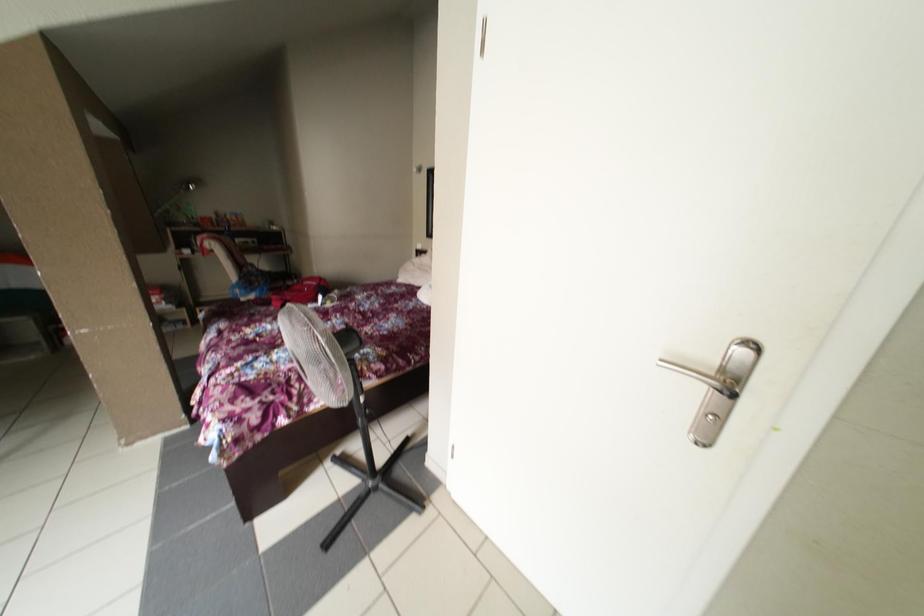
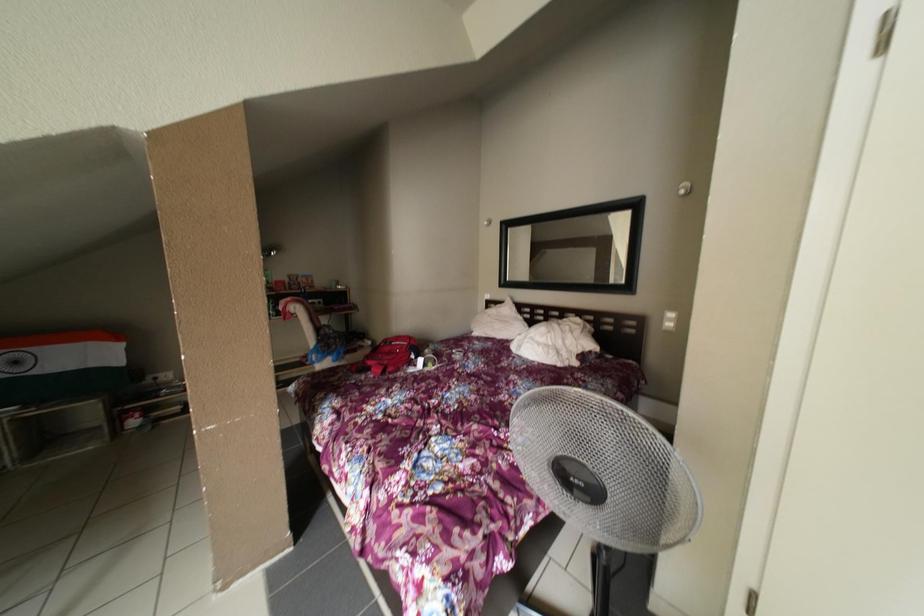
Question: The first image is from the beginning of the video and the second image is from the end. How did the camera likely rotate when shooting the video?

Choices:
 (A) Left
 (B) Right
 (C) Up
 (D) Down

Answer: (C)